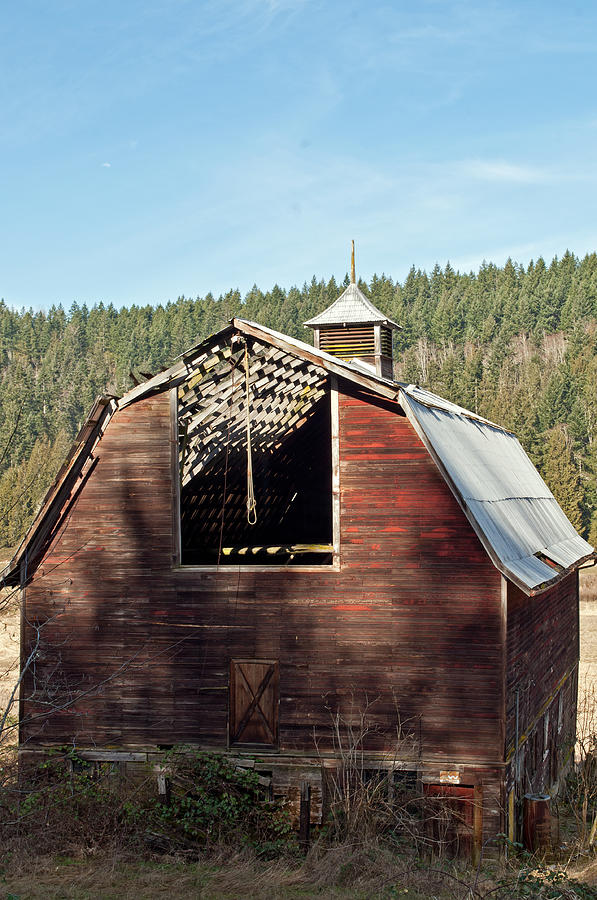
Locate an element on the screen. chimney is located at coordinates (359, 340).